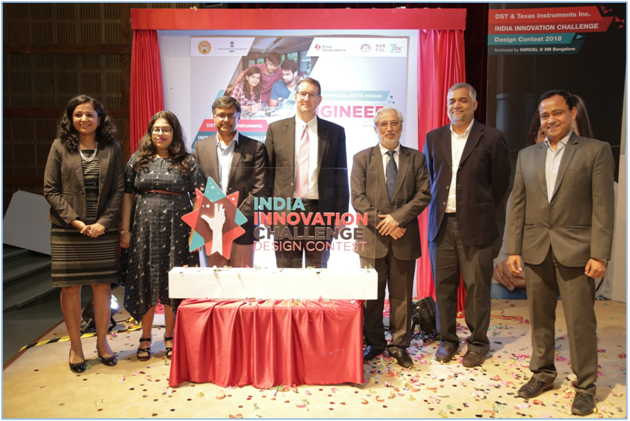
At what (x,y) coordinates should I click in order to perform the action: click on award. Please return your answer as a coordinate pair (x, y). Looking at the image, I should click on (280, 252).